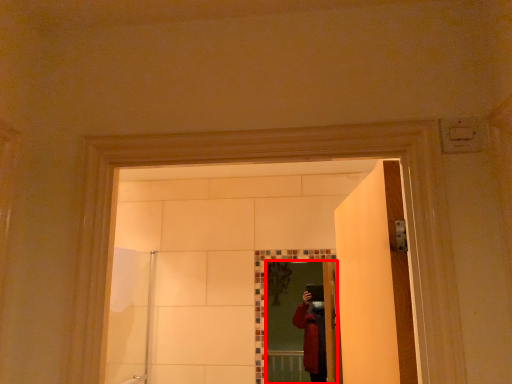
Question: From the image, what is the correct spatial relationship of mirror (annotated by the red box) in relation to shower door?

Choices:
 (A) right
 (B) left

Answer: (A)